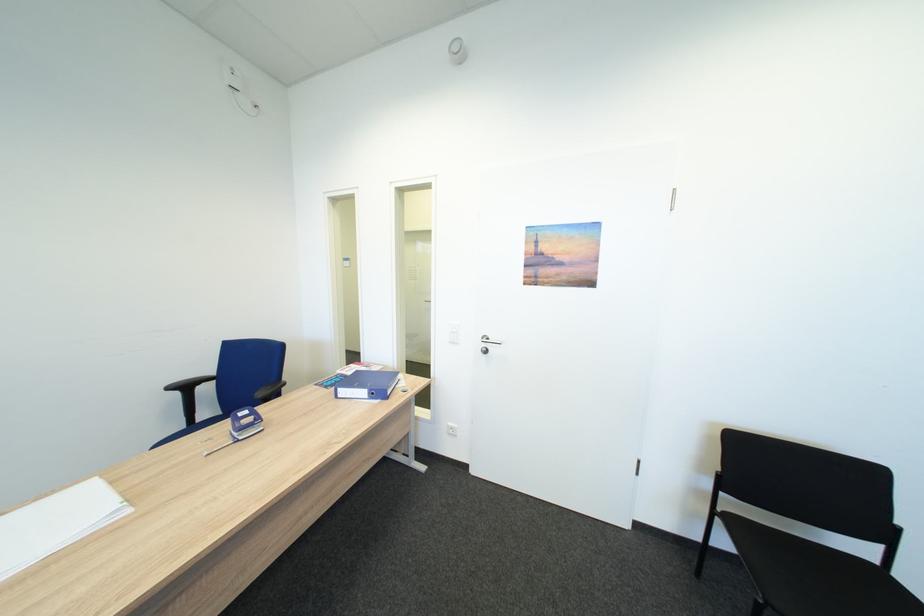
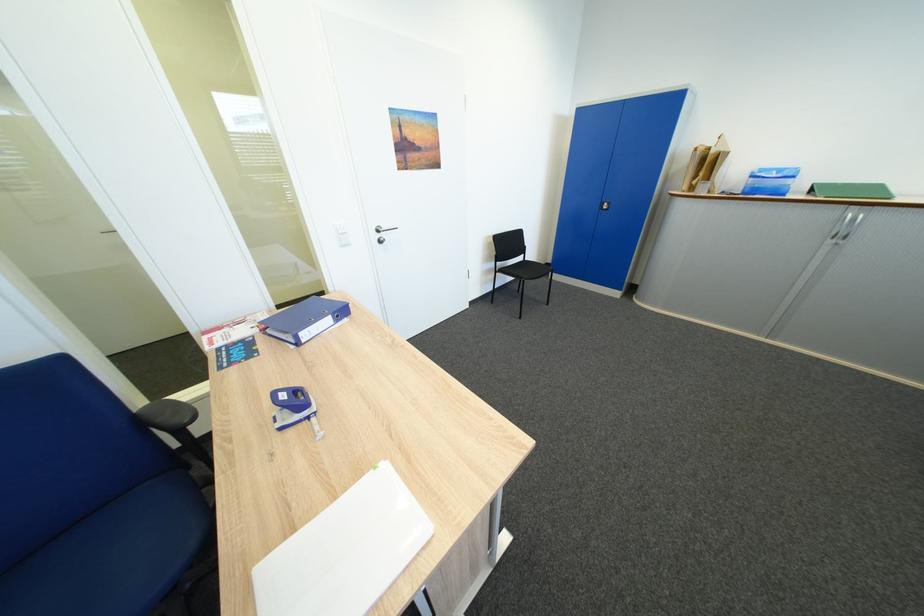
Locate, in the second image, the point that corresponds to point (349, 391) in the first image.

(310, 334)